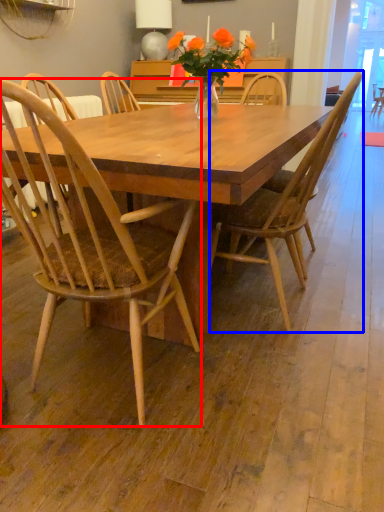
Question: Which object is closer to the camera taking this photo, chair (highlighted by a red box) or chair (highlighted by a blue box)?

Choices:
 (A) chair
 (B) chair

Answer: (A)